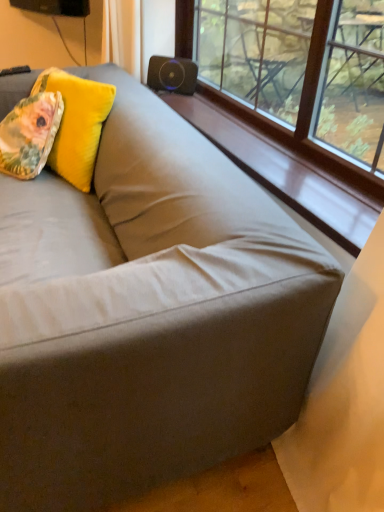
Question: From a real-world perspective, is fluffy yellow pillow at upper left, which appears as the 1th throw pillow when viewed from the back, positioned under black matte speaker at upper center based on gravity?

Choices:
 (A) yes
 (B) no

Answer: (A)

Question: Is the position of fluffy yellow pillow at upper left, which appears as the 1th throw pillow when viewed from the back, more distant than that of black matte speaker at upper center?

Choices:
 (A) yes
 (B) no

Answer: (B)

Question: Is fluffy yellow pillow at upper left, which appears as the 1th throw pillow when viewed from the back, oriented away from black matte speaker at upper center?

Choices:
 (A) no
 (B) yes

Answer: (B)

Question: Does fluffy yellow pillow at upper left, the second throw pillow viewed from the front, have a larger size compared to black matte speaker at upper center?

Choices:
 (A) yes
 (B) no

Answer: (A)

Question: Is black matte speaker at upper center surrounded by fluffy yellow pillow at upper left, which appears as the 1th throw pillow when viewed from the back?

Choices:
 (A) yes
 (B) no

Answer: (B)

Question: Is fluffy yellow pillow at upper left, which appears as the 1th throw pillow when viewed from the back, taller than black matte speaker at upper center?

Choices:
 (A) no
 (B) yes

Answer: (B)

Question: From the image's perspective, does black matte speaker at upper center appear lower than floral fabric pillow at upper left, the first throw pillow in the front-to-back sequence?

Choices:
 (A) yes
 (B) no

Answer: (B)

Question: Is black matte speaker at upper center taller than floral fabric pillow at upper left, the 2th throw pillow when ordered from back to front?

Choices:
 (A) yes
 (B) no

Answer: (B)

Question: Is the position of black matte speaker at upper center more distant than that of floral fabric pillow at upper left, the 2th throw pillow when ordered from back to front?

Choices:
 (A) yes
 (B) no

Answer: (A)

Question: Considering the relative positions of black matte speaker at upper center and floral fabric pillow at upper left, the 2th throw pillow when ordered from back to front, in the image provided, is black matte speaker at upper center to the left of floral fabric pillow at upper left, the 2th throw pillow when ordered from back to front, from the viewer's perspective?

Choices:
 (A) yes
 (B) no

Answer: (B)

Question: Considering the relative sizes of black matte speaker at upper center and floral fabric pillow at upper left, the first throw pillow in the front-to-back sequence, in the image provided, is black matte speaker at upper center smaller than floral fabric pillow at upper left, the first throw pillow in the front-to-back sequence,?

Choices:
 (A) no
 (B) yes

Answer: (B)

Question: Is black matte speaker at upper center to the right of floral fabric pillow at upper left, the first throw pillow in the front-to-back sequence, from the viewer's perspective?

Choices:
 (A) no
 (B) yes

Answer: (B)

Question: Is fluffy yellow pillow at upper left, the second throw pillow viewed from the front, taller than floral fabric pillow at upper left, the first throw pillow in the front-to-back sequence?

Choices:
 (A) no
 (B) yes

Answer: (B)